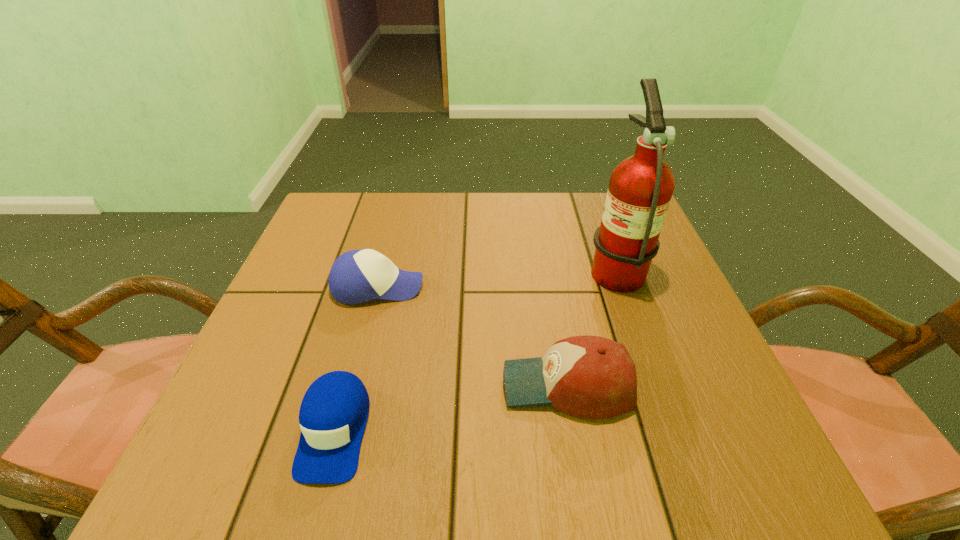
Find the location of `fire extinguisher`. fire extinguisher is located at coordinates (640, 189).

Identify the location of the tallest baseball cap. (593, 377).

In order to click on the rightmost baseball cap in this screenshot , I will do `click(593, 377)`.

Locate an element on the screen. The height and width of the screenshot is (540, 960). the farthest baseball cap is located at coordinates (357, 276).

In order to click on the shortest baseball cap in this screenshot , I will do `click(333, 414)`.

This screenshot has height=540, width=960. In order to click on free space located 0.230m on the nozzle and handle of the tallest object in this screenshot , I will do `click(485, 267)`.

I want to click on free space located 0.330m on the nozzle and handle of the tallest object, so click(442, 267).

Where is `vacant region located 0.050m on the nozzle and handle of the tallest object`? This screenshot has width=960, height=540. vacant region located 0.050m on the nozzle and handle of the tallest object is located at coordinates (564, 267).

Locate an element on the screen. This screenshot has width=960, height=540. vacant space situated 0.320m on the front-facing side of the rightmost baseball cap is located at coordinates (319, 386).

This screenshot has width=960, height=540. What are the coordinates of `free space located 0.280m on the front-facing side of the rightmost baseball cap` in the screenshot? It's located at (342, 386).